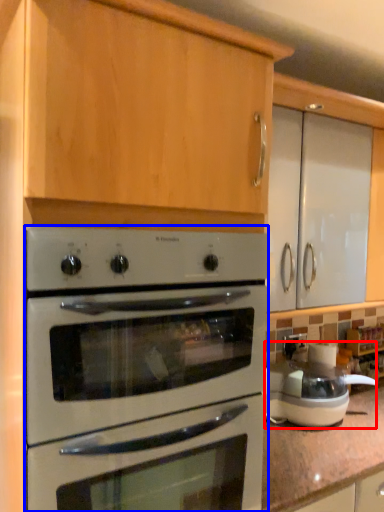
Question: Among these objects, which one is farthest to the camera, appliance (highlighted by a red box) or oven (highlighted by a blue box)?

Choices:
 (A) appliance
 (B) oven

Answer: (A)